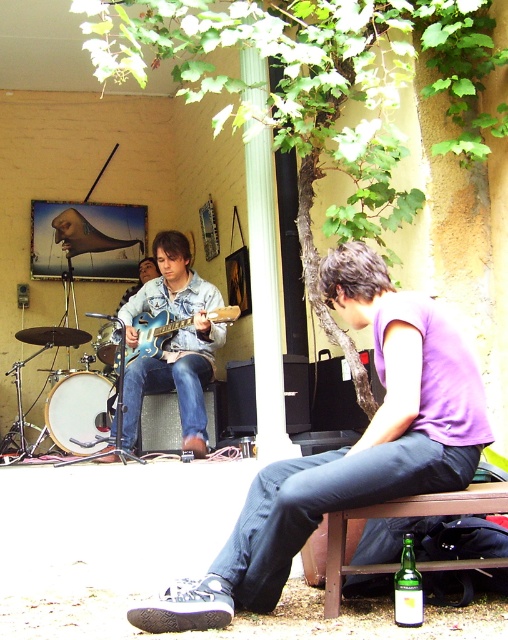
Is point (170, 230) in front of point (420, 611)?

No.

Looking at this image, is matte blue guitar at center wider than green glass bottle at lower right?

Yes.

Is point (181, 348) positioned after point (410, 621)?

Yes, point (181, 348) is behind point (410, 621).

The width and height of the screenshot is (508, 640). Find the location of `matte blue guitar at center`. matte blue guitar at center is located at coordinates (174, 342).

Describe the element at coordinates (174, 342) in the screenshot. This screenshot has height=640, width=508. I see `matte blue guitar at center` at that location.

Which of these two, matte blue guitar at center or blue metallic guitar at center, stands shorter?

With less height is blue metallic guitar at center.

Who is more distant from viewer, [194,422] or [212,317]?

The point [212,317] is behind.

Find the location of a particular element. This screenshot has height=640, width=508. matte blue guitar at center is located at coordinates (174, 342).

What do you see at coordinates (153, 333) in the screenshot? I see `blue metallic guitar at center` at bounding box center [153, 333].

Consider the image. Does blue metallic guitar at center appear on the left side of green glass bottle at lower right?

Correct, you'll find blue metallic guitar at center to the left of green glass bottle at lower right.

Where is `blue metallic guitar at center`? The image size is (508, 640). blue metallic guitar at center is located at coordinates tap(153, 333).